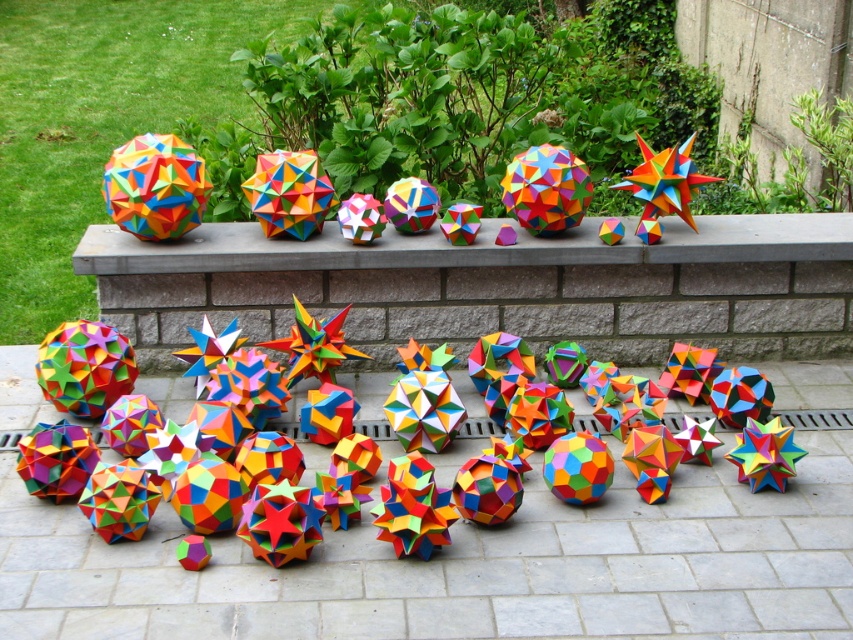
Question: Does matte colorful origami at upper center appear on the right side of multicolored paper at center?

Choices:
 (A) no
 (B) yes

Answer: (B)

Question: Which object is closer to the camera taking this photo?

Choices:
 (A) multicolored paper at center
 (B) matte colorful origami at upper center

Answer: (A)

Question: Which point is closer to the camera?

Choices:
 (A) multicolored paper at center
 (B) matte colorful origami at upper center

Answer: (A)

Question: Considering the relative positions of matte colorful origami at upper center and multicolored paper at center in the image provided, where is matte colorful origami at upper center located with respect to multicolored paper at center?

Choices:
 (A) left
 (B) right

Answer: (B)

Question: Which of the following is the farthest from the observer?

Choices:
 (A) (819, 252)
 (B) (656, 289)

Answer: (B)

Question: Does matte colorful origami at upper center have a lesser width compared to multicolored paper at center?

Choices:
 (A) yes
 (B) no

Answer: (A)